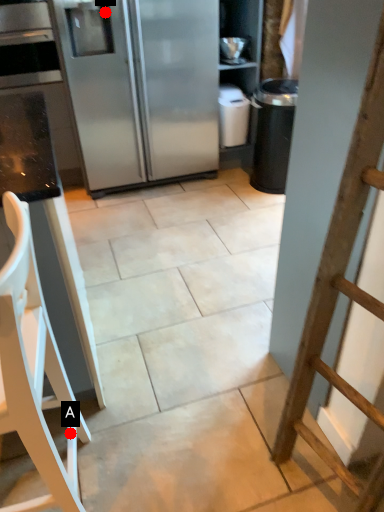
Question: Two points are circled on the image, labeled by A and B beside each circle. Which point is farther to the camera?

Choices:
 (A) A is further
 (B) B is further

Answer: (B)